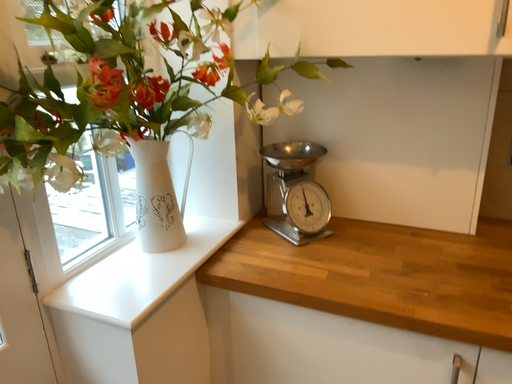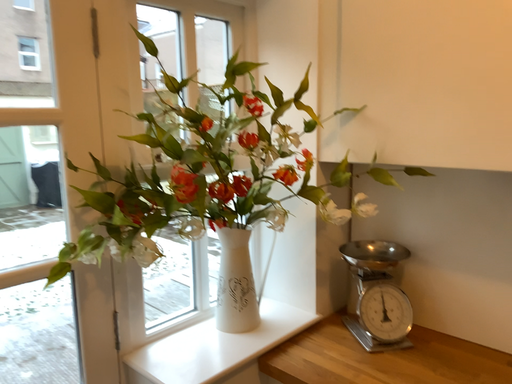
Question: How did the camera likely rotate when shooting the video?

Choices:
 (A) rotated left
 (B) rotated right

Answer: (A)